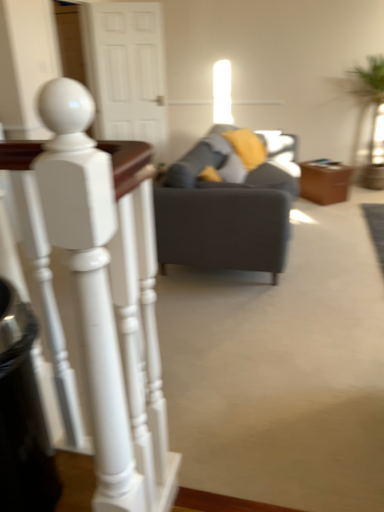
Question: Is gray fabric swivel chair at center smaller than white wood door at upper center?

Choices:
 (A) yes
 (B) no

Answer: (B)

Question: Does gray fabric swivel chair at center appear on the left side of white wood door at upper center?

Choices:
 (A) no
 (B) yes

Answer: (A)

Question: Does gray fabric swivel chair at center contain white wood door at upper center?

Choices:
 (A) yes
 (B) no

Answer: (B)

Question: Does gray fabric swivel chair at center touch white wood door at upper center?

Choices:
 (A) yes
 (B) no

Answer: (B)

Question: Is the position of gray fabric swivel chair at center more distant than that of white wood door at upper center?

Choices:
 (A) yes
 (B) no

Answer: (B)

Question: Does gray fabric swivel chair at center have a lesser height compared to white wood door at upper center?

Choices:
 (A) no
 (B) yes

Answer: (B)

Question: From a real-world perspective, is white wood door at upper center under white glossy staircase railing at left?

Choices:
 (A) yes
 (B) no

Answer: (B)

Question: Does white wood door at upper center have a smaller size compared to white glossy staircase railing at left?

Choices:
 (A) yes
 (B) no

Answer: (B)

Question: Can you see white wood door at upper center touching white glossy staircase railing at left?

Choices:
 (A) no
 (B) yes

Answer: (A)

Question: Could you tell me if white wood door at upper center is facing white glossy staircase railing at left?

Choices:
 (A) yes
 (B) no

Answer: (A)

Question: From a real-world perspective, is white wood door at upper center over white glossy staircase railing at left?

Choices:
 (A) no
 (B) yes

Answer: (B)

Question: Can you confirm if white wood door at upper center is thinner than white glossy staircase railing at left?

Choices:
 (A) no
 (B) yes

Answer: (B)

Question: Is brown leather side table at center at the left side of black plastic trash can at lower left?

Choices:
 (A) yes
 (B) no

Answer: (B)